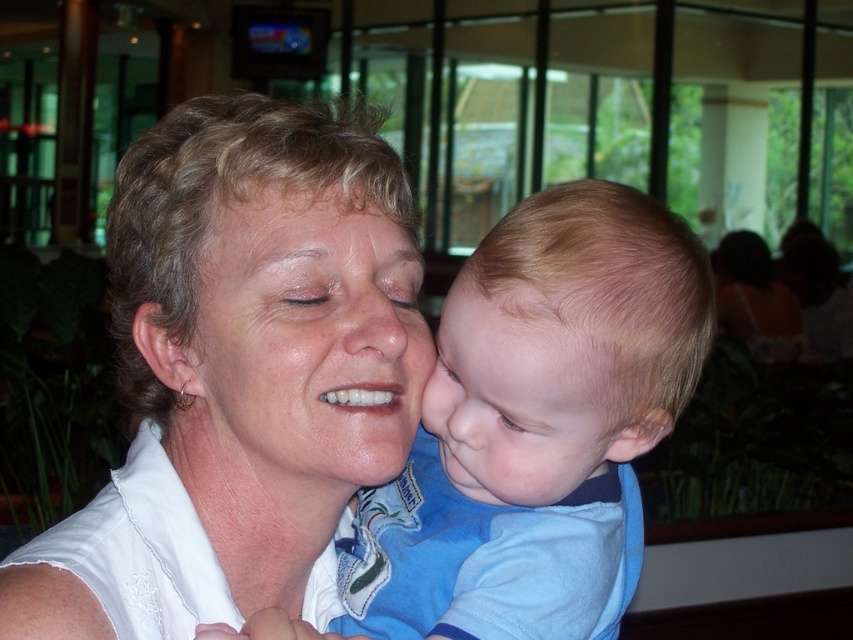
Question: Among these points, which one is farthest from the camera?

Choices:
 (A) (312, 195)
 (B) (282, 384)

Answer: (A)

Question: Which object is positioned closest to the light brown hair at center?

Choices:
 (A) smooth skin face at center
 (B) smooth skin nose at center

Answer: (B)

Question: Is white fabric at center thinner than smooth skin at center?

Choices:
 (A) no
 (B) yes

Answer: (A)

Question: Which object is positioned farthest from the smooth skin nose at center?

Choices:
 (A) smooth skin face at center
 (B) blue cotton shirt at center
 (C) smooth skin at center
 (D) white fabric at center

Answer: (D)

Question: Is smooth skin face at center further to the viewer compared to light brown hair at center?

Choices:
 (A) no
 (B) yes

Answer: (B)

Question: Is blue cotton shirt at center thinner than smooth skin at center?

Choices:
 (A) no
 (B) yes

Answer: (A)